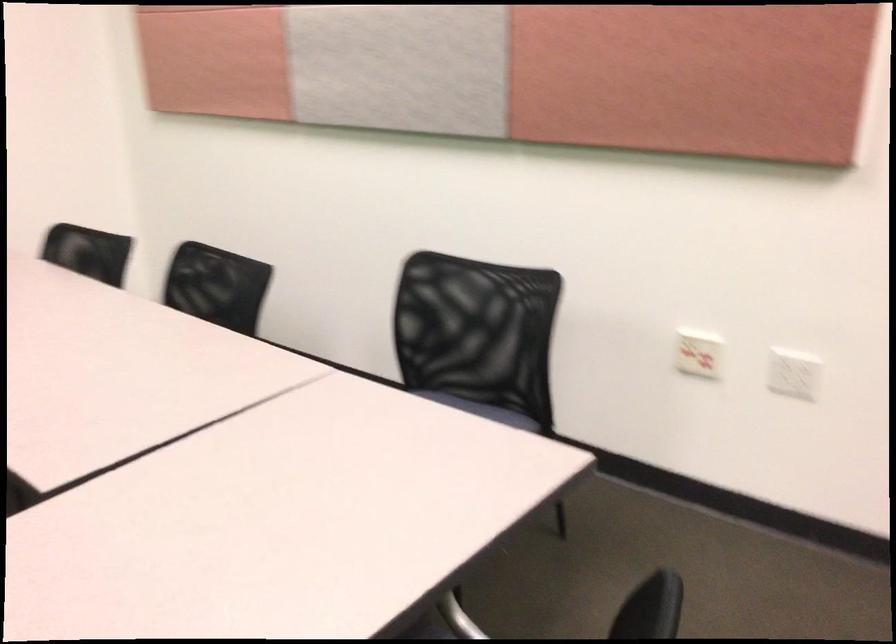
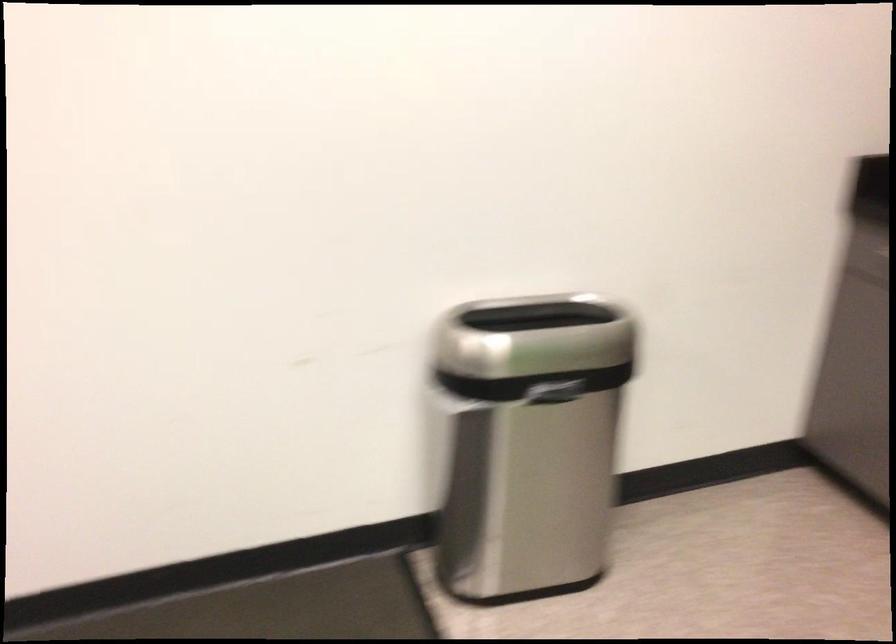
Question: The first image is from the beginning of the video and the second image is from the end. How did the camera likely rotate when shooting the video?

Choices:
 (A) Left
 (B) Right
 (C) Up
 (D) Down

Answer: (B)